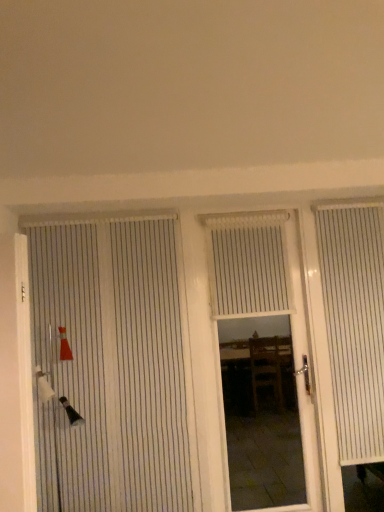
Question: Would you consider white wood door at center, arranged as the 2th door when viewed from the left, to be distant from white striped door at left, the first door when ordered from left to right?

Choices:
 (A) yes
 (B) no

Answer: (A)

Question: Is white striped door at left, the 2th door from the right, at the back of white wood door at center, marked as the first door in a right-to-left arrangement?

Choices:
 (A) no
 (B) yes

Answer: (A)

Question: Is white wood door at center, arranged as the 2th door when viewed from the left, completely or partially outside of white striped door at left, the first door when ordered from left to right?

Choices:
 (A) yes
 (B) no

Answer: (A)

Question: Is white wood door at center, arranged as the 2th door when viewed from the left, positioned in front of white striped door at left, the first door when ordered from left to right?

Choices:
 (A) no
 (B) yes

Answer: (A)

Question: Does white wood door at center, marked as the first door in a right-to-left arrangement, have a lesser width compared to white striped door at left, the 2th door from the right?

Choices:
 (A) no
 (B) yes

Answer: (A)

Question: Is white wood door at center, marked as the first door in a right-to-left arrangement, to the left of white striped door at left, the 2th door from the right, from the viewer's perspective?

Choices:
 (A) no
 (B) yes

Answer: (A)

Question: Is white textured blind at center surrounding white striped curtain at right?

Choices:
 (A) yes
 (B) no

Answer: (B)

Question: Is white textured blind at center facing towards white striped curtain at right?

Choices:
 (A) no
 (B) yes

Answer: (A)

Question: Can you confirm if white textured blind at center is bigger than white striped curtain at right?

Choices:
 (A) no
 (B) yes

Answer: (A)

Question: From a real-world perspective, is white textured blind at center positioned over white striped curtain at right based on gravity?

Choices:
 (A) no
 (B) yes

Answer: (B)

Question: Is white textured blind at center smaller than white striped curtain at right?

Choices:
 (A) yes
 (B) no

Answer: (A)

Question: Is white textured blind at center outside white striped curtain at right?

Choices:
 (A) yes
 (B) no

Answer: (A)

Question: Does white striped door at left, the first door when ordered from left to right, appear on the right side of white textured blind at center?

Choices:
 (A) yes
 (B) no

Answer: (B)